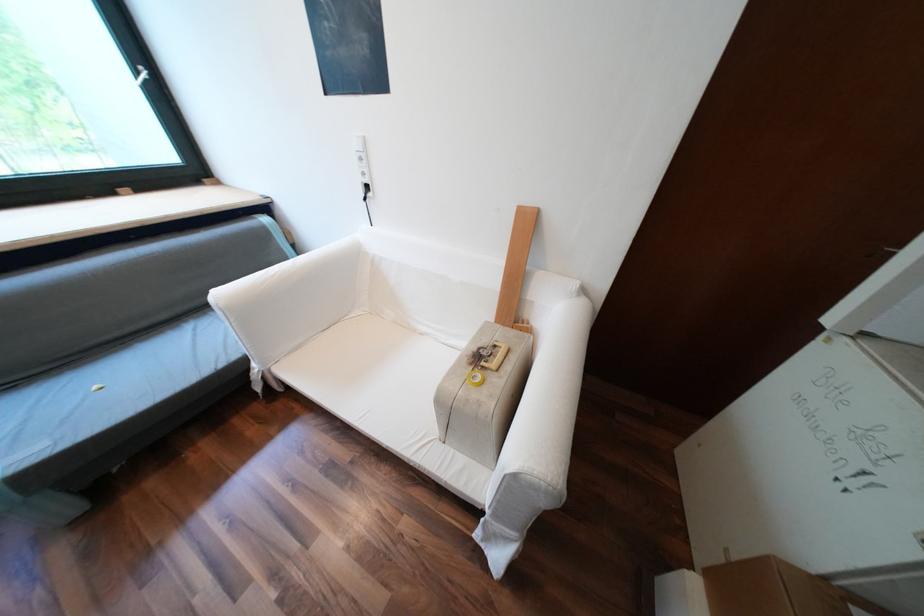
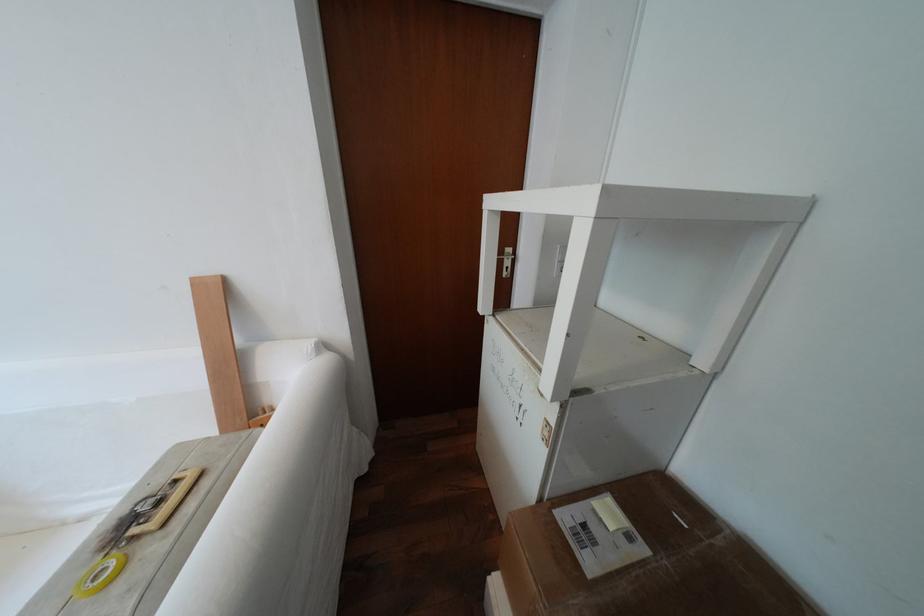
Question: How did the camera likely rotate?

Choices:
 (A) Left
 (B) Right
 (C) Up
 (D) Down

Answer: (B)